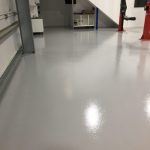
The image size is (150, 150). In order to click on shiny white floor in this screenshot , I will do `click(30, 65)`, `click(58, 35)`, `click(124, 37)`, `click(137, 75)`, `click(71, 69)`, `click(126, 118)`, `click(40, 131)`.